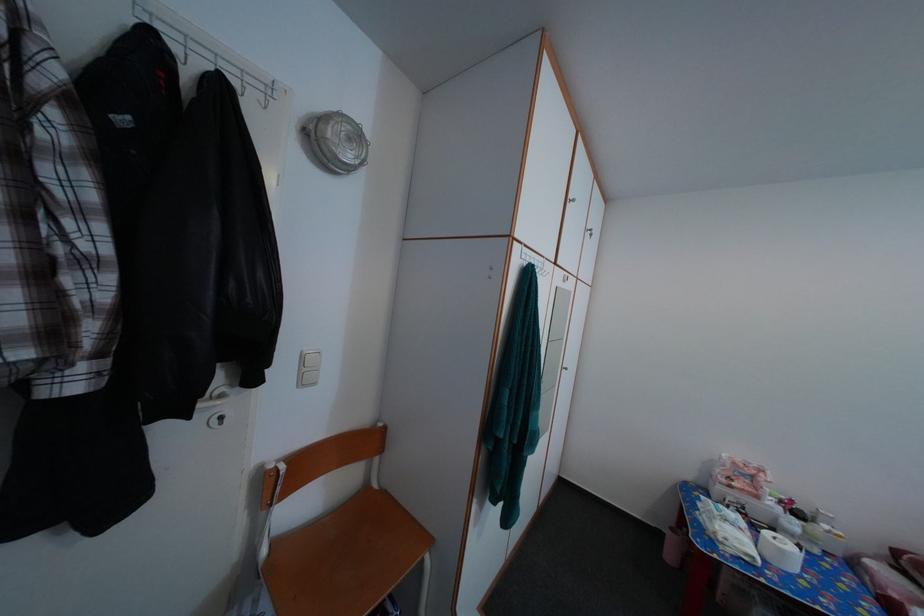
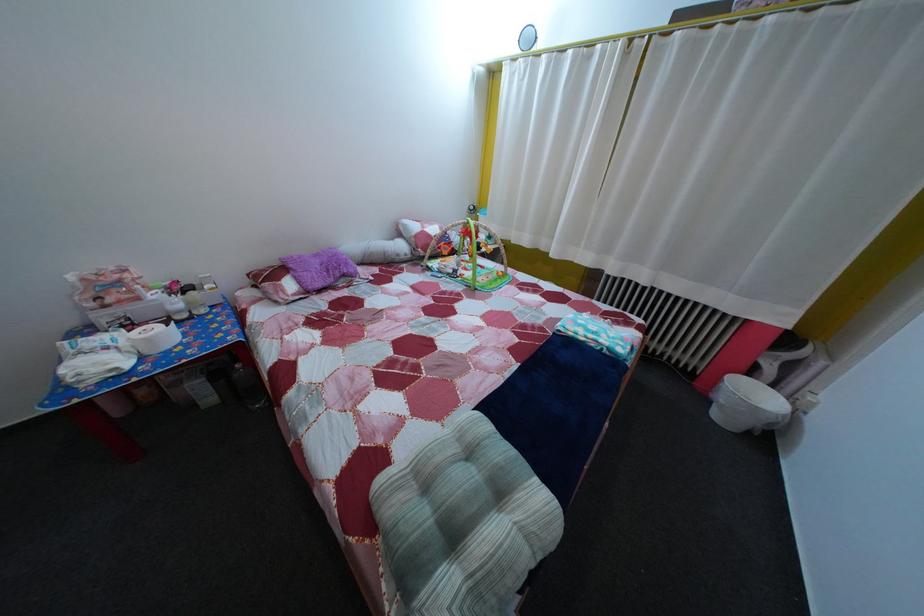
Where in the second image is the point corresponding to (x=834, y=535) from the first image?

(216, 294)